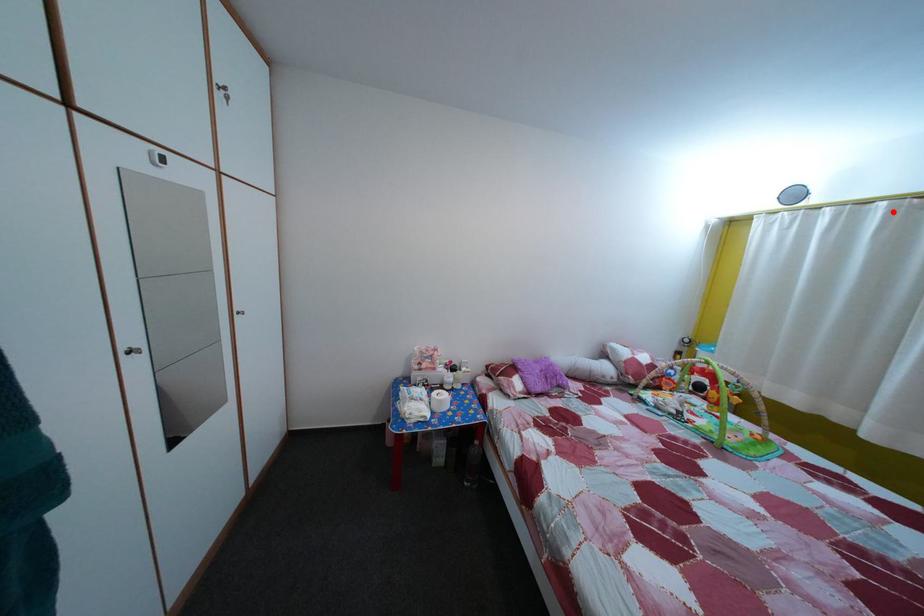
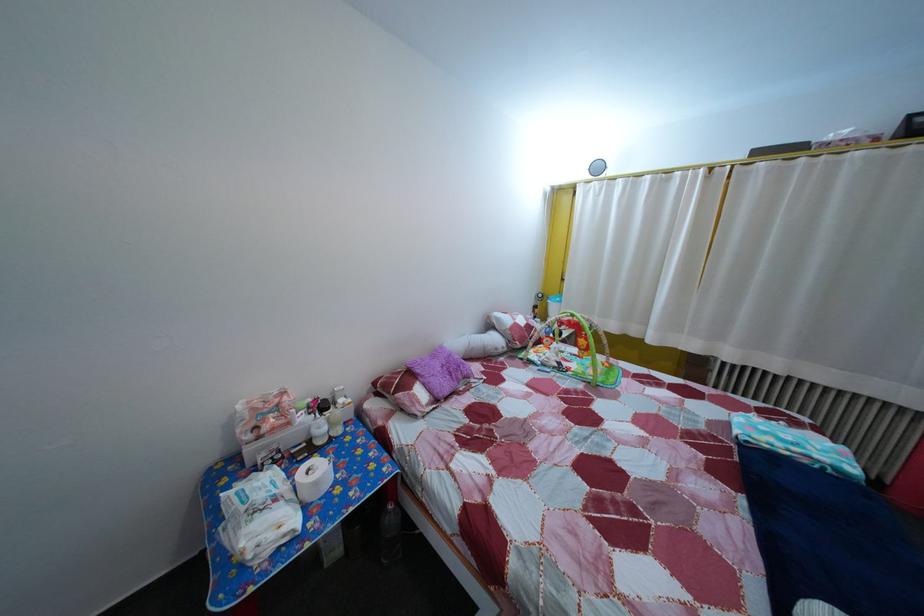
Find the pixel in the second image that matches the highlighted location in the first image.

(659, 185)